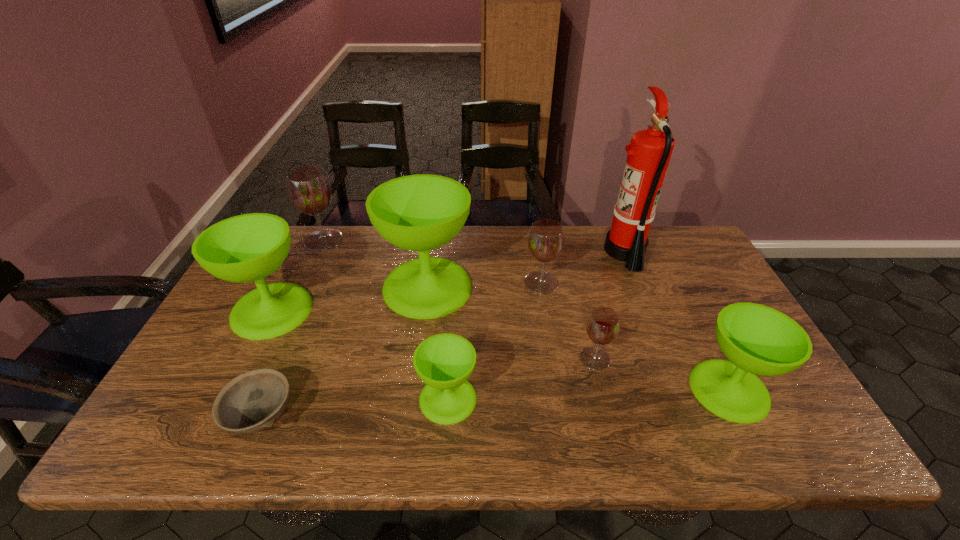
Where is `free space that is in between the rightmost green wineglass and the tallest object`? free space that is in between the rightmost green wineglass and the tallest object is located at coordinates coord(677,321).

This screenshot has width=960, height=540. In order to click on vacant space that's between the fire extinguisher and the rightmost red wineglass in this screenshot , I will do `click(610, 305)`.

Find the location of a particular element. This screenshot has height=540, width=960. free spot between the farthest red wineglass and the second smallest green wineglass is located at coordinates (526, 315).

The height and width of the screenshot is (540, 960). I want to click on empty space that is in between the second red wineglass from left to right and the seventh object from left to right, so click(568, 320).

Locate an element on the screen. The height and width of the screenshot is (540, 960). free spot between the farthest wineglass and the leftmost green wineglass is located at coordinates (298, 275).

I want to click on the third closest object to the leftmost red wineglass, so click(253, 401).

The width and height of the screenshot is (960, 540). Identify the location of object identified as the eighth closest to the leftmost red wineglass. (756, 339).

Locate which wineglass ranks fourth in proximity to the gray bowl. Please provide its 2D coordinates. Your answer should be formatted as a tuple, i.e. [(x, y)], where the tuple contains the x and y coordinates of a point satisfying the conditions above.

[(308, 187)]

Identify which wineglass is the closest to the smallest green wineglass. Please provide its 2D coordinates. Your answer should be formatted as a tuple, i.e. [(x, y)], where the tuple contains the x and y coordinates of a point satisfying the conditions above.

[(422, 212)]

Where is `green wineglass that can be found as the closest to the bowl`? green wineglass that can be found as the closest to the bowl is located at coordinates (244, 248).